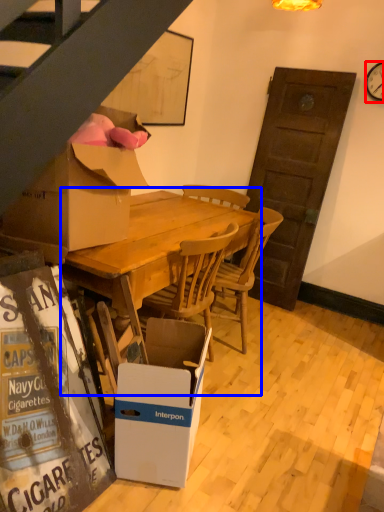
Question: Which of the following is the closest to the observer, clock (highlighted by a red box) or round table (highlighted by a blue box)?

Choices:
 (A) clock
 (B) round table

Answer: (B)